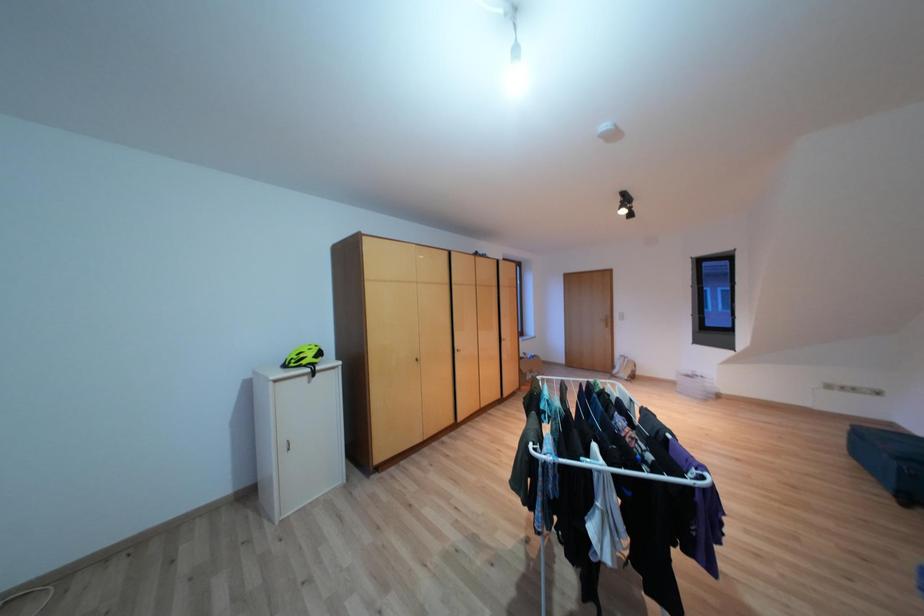
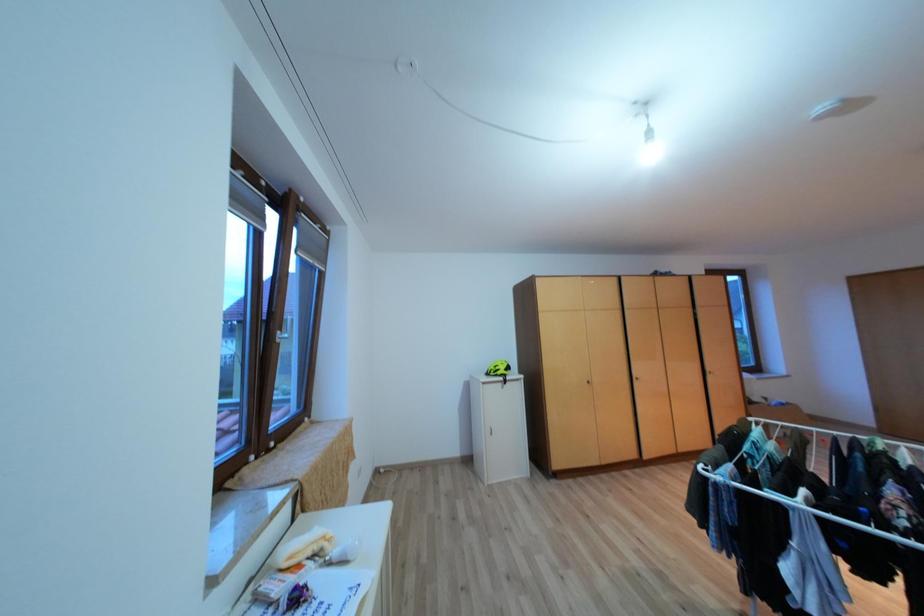
Question: The camera is either moving clockwise (left) or counter-clockwise (right) around the object. The first image is from the beginning of the video and the second image is from the end. Is the camera moving left or right when shooting the video?

Choices:
 (A) Left
 (B) Right

Answer: (B)